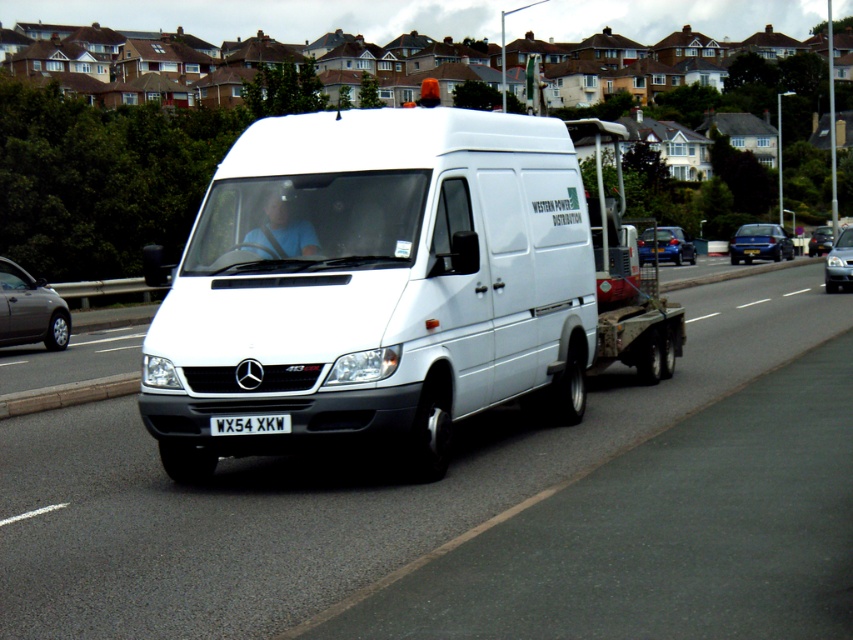
Question: Estimate the real-world distances between objects in this image. Which object is closer to the white matte flatbed truck at center?

Choices:
 (A) white glossy van at center
 (B) white matte van at center
 (C) metallic blue hatchback at center
 (D) blue metallic car at center

Answer: (D)

Question: Is white matte flatbed truck at center bigger than white metallic license plate at center?

Choices:
 (A) yes
 (B) no

Answer: (A)

Question: Which point is closer to the camera taking this photo?

Choices:
 (A) (416, 324)
 (B) (840, 240)
 (C) (761, 224)

Answer: (A)

Question: Can you confirm if white glossy van at center is bigger than silver metallic sedan at center?

Choices:
 (A) yes
 (B) no

Answer: (A)

Question: Which point is closer to the camera taking this photo?

Choices:
 (A) (637, 250)
 (B) (263, 588)
 (C) (820, 237)

Answer: (B)

Question: Is metallic blue hatchback at center to the left of metallic blue sedan at center from the viewer's perspective?

Choices:
 (A) yes
 (B) no

Answer: (A)